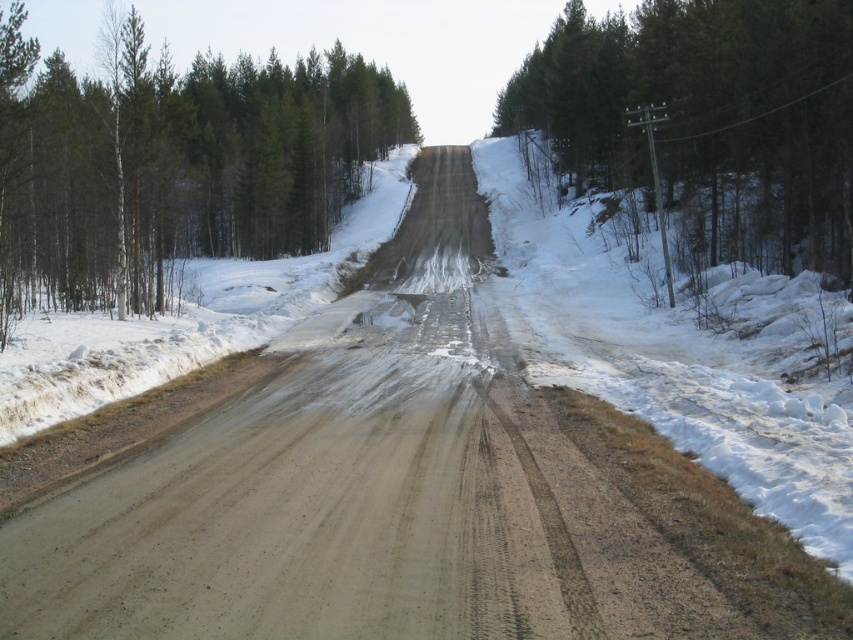
Does green matte tree at upper left appear under green textured tree at right?

Incorrect, green matte tree at upper left is not positioned below green textured tree at right.

Is green matte tree at upper left positioned behind green textured tree at right?

No, it is not.

This screenshot has width=853, height=640. I want to click on green matte tree at upper left, so click(173, 163).